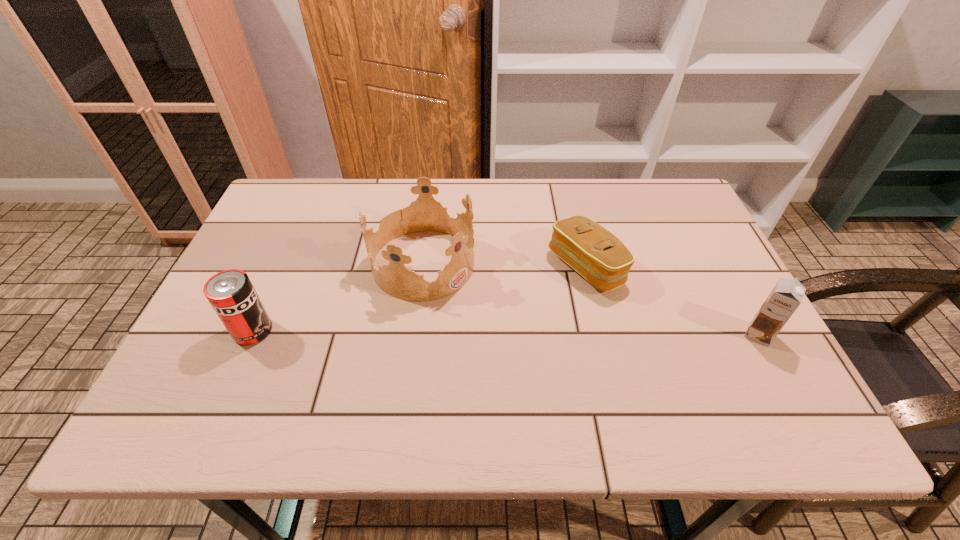
This screenshot has width=960, height=540. I want to click on vacant space located 0.110m on the zipper side of the second object from right to left, so click(x=521, y=299).

Where is `vacant space located on the zipper side of the second object from right to left`? vacant space located on the zipper side of the second object from right to left is located at coordinates pyautogui.click(x=541, y=290).

This screenshot has width=960, height=540. What are the coordinates of `free space located 0.270m on the zipper side of the second object from right to left` in the screenshot? It's located at (465, 325).

Identify the location of object located in the left edge section of the desktop. (231, 294).

Locate an element on the screen. The width and height of the screenshot is (960, 540). object situated at the right edge is located at coordinates (786, 296).

Find the location of `vacant space at the far edge of the desktop`. vacant space at the far edge of the desktop is located at coordinates (514, 205).

In the image, there is a desktop. Where is `free space at the near edge`? The image size is (960, 540). free space at the near edge is located at coordinates (445, 367).

Identify the location of vacant region at the left edge of the desktop. (258, 237).

At what (x,y) coordinates should I click in order to perform the action: click on free location at the right edge of the desktop. Please return your answer as a coordinate pair (x, y). The width and height of the screenshot is (960, 540). Looking at the image, I should click on (725, 343).

Find the location of a particular element. The width and height of the screenshot is (960, 540). free space at the near right corner of the desktop is located at coordinates (740, 377).